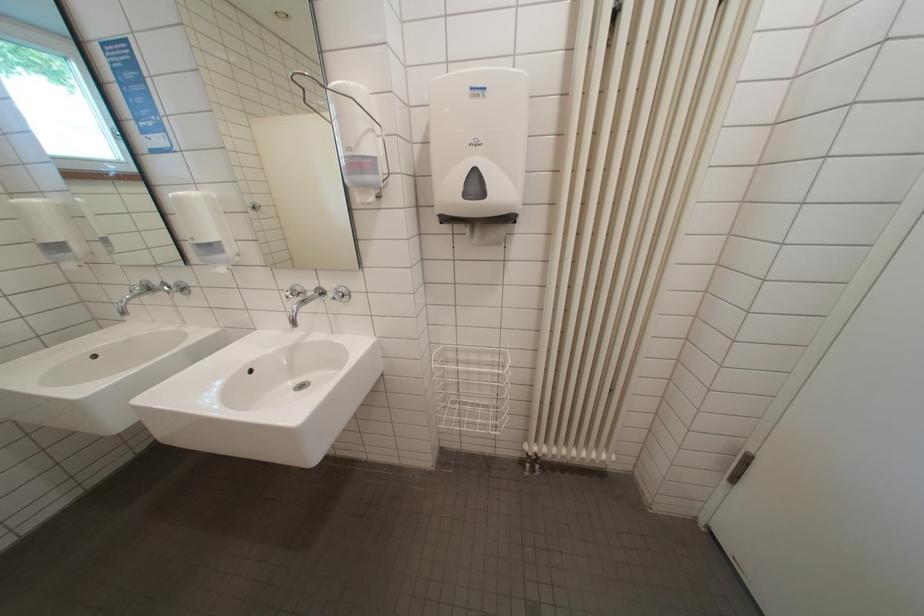
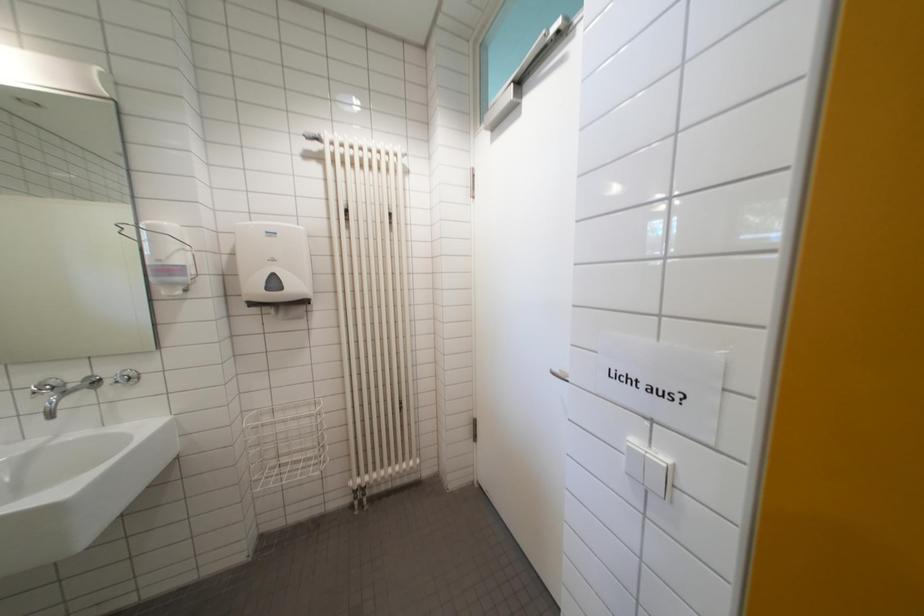
Question: The first image is from the beginning of the video and the second image is from the end. How did the camera likely rotate when shooting the video?

Choices:
 (A) Left
 (B) Right
 (C) Up
 (D) Down

Answer: (B)